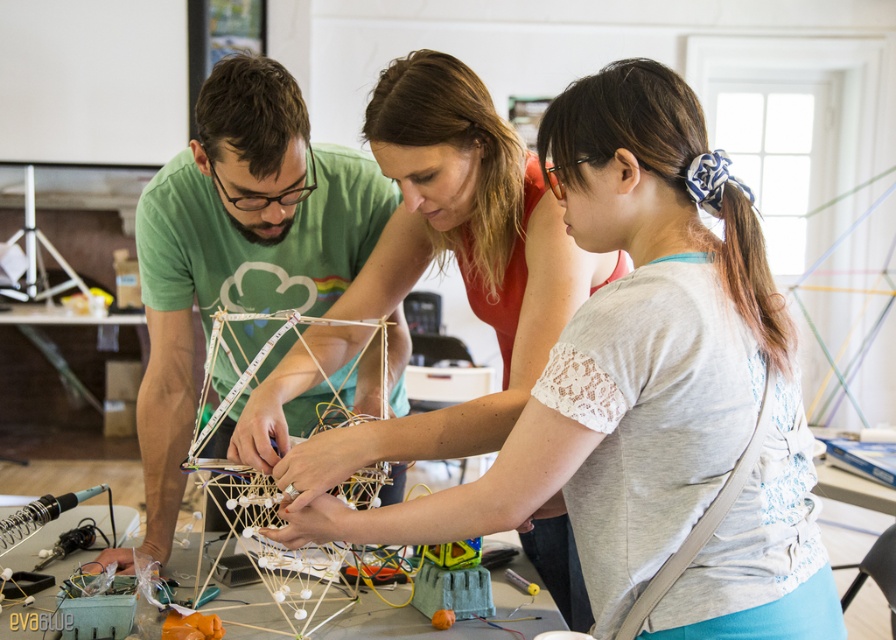
Based on the scene description, where is the white lace shirt at center located in terms of its 2D coordinates?

The white lace shirt at center is located at the 2D coordinates of point (648,392).

You are a photographer in the workshop and want to capture a photo where both the white lace shirt at center and the green matte shirt at center are visible. Given their height difference, which shirt should you position closer to the camera to ensure both are fully visible in the frame?

The white lace shirt at center is shorter than the green matte shirt at center. To ensure both are fully visible, position the white lace shirt at center closer to the camera since it is shorter, allowing its full height to be captured without being obscured by the taller green matte shirt at center.

You are organizing a clothing donation drive and need to categorize shirts by size. You have a white lace shirt at center and a green matte shirt at center. Which shirt should you place in the small size bin?

The white lace shirt at center has a smaller size compared to the green matte shirt at center, so it should be placed in the small size bin.